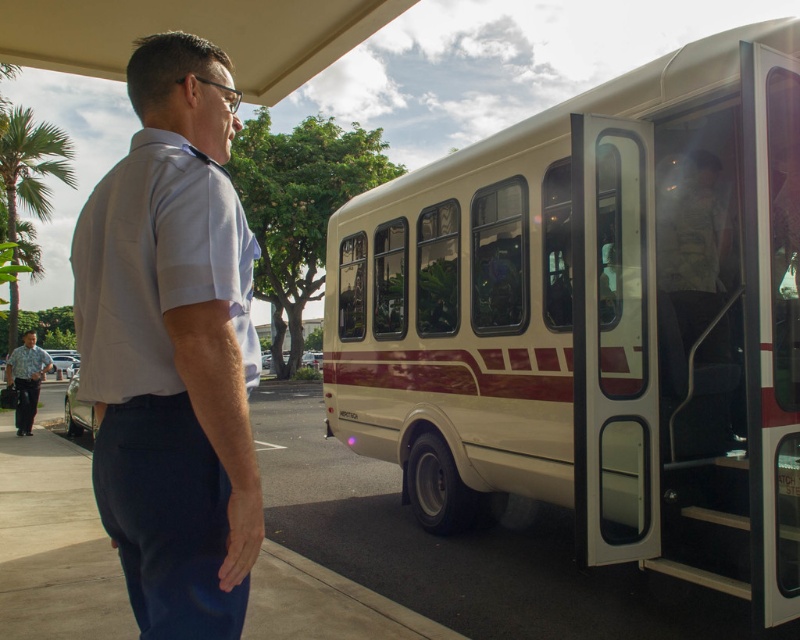
Question: Is clear glass door at center below patterned shirt at left?

Choices:
 (A) yes
 (B) no

Answer: (B)

Question: Which point is farther from the camera taking this photo?

Choices:
 (A) (796, 147)
 (B) (22, 364)
 (C) (210, 440)

Answer: (B)

Question: Does beige/wooden bus at right have a smaller size compared to patterned shirt at left?

Choices:
 (A) yes
 (B) no

Answer: (A)

Question: Based on their relative distances, which object is nearer to the clear glass door at center?

Choices:
 (A) light blue shirt at center
 (B) beige/wooden bus at right
 (C) green leafy palm tree at upper left

Answer: (B)

Question: Is clear glass door at center to the left of green leafy palm tree at upper left from the viewer's perspective?

Choices:
 (A) no
 (B) yes

Answer: (A)

Question: Which point is closer to the camera?

Choices:
 (A) patterned shirt at left
 (B) beige/wooden bus at right
 (C) clear glass door at center
 (D) light blue shirt at center

Answer: (D)